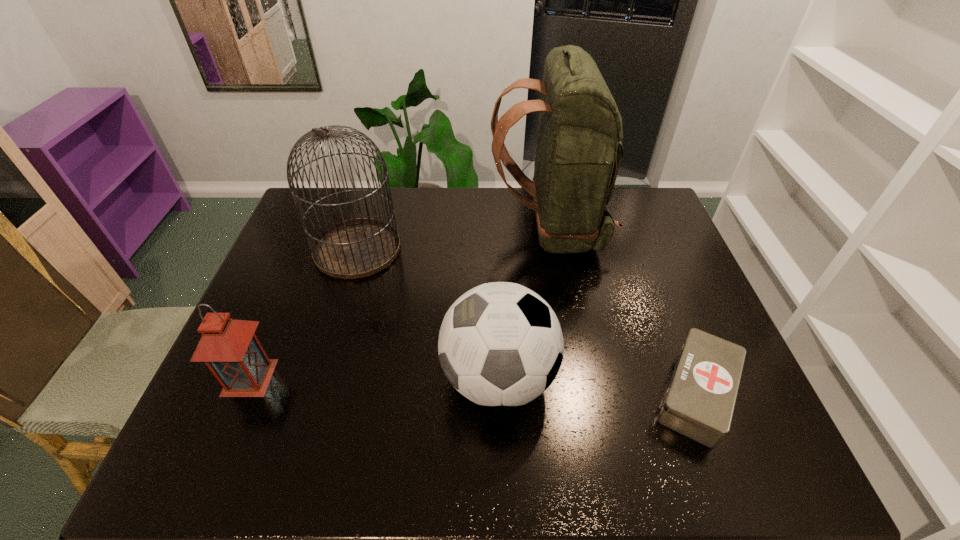
You are a GUI agent. You are given a task and a screenshot of the screen. Output one action in this format:
    pyautogui.click(x=<x>, y=<y>)
    Task: Click on the object located at the far left corner
    The width and height of the screenshot is (960, 540).
    Given the screenshot: What is the action you would take?
    pyautogui.click(x=356, y=248)

This screenshot has height=540, width=960. What are the coordinates of `object positioned at the near right corner` in the screenshot? It's located at (699, 403).

Where is `vacant point at the far edge`? vacant point at the far edge is located at coordinates (463, 219).

Locate an element on the screen. Image resolution: width=960 pixels, height=540 pixels. free space at the near edge is located at coordinates (385, 460).

Find the location of `vacant space at the right edge`. vacant space at the right edge is located at coordinates [632, 251].

In order to click on free space at the far right corner of the desktop in this screenshot , I will do `click(643, 227)`.

The image size is (960, 540). Find the location of `free space between the first-aid kit and the soccer ball`. free space between the first-aid kit and the soccer ball is located at coordinates (597, 386).

You are a GUI agent. You are given a task and a screenshot of the screen. Output one action in this format:
    pyautogui.click(x=<x>, y=<y>)
    Task: Click on the unoccupied position between the shortest object and the soccer ball
    Image resolution: width=960 pixels, height=540 pixels.
    Given the screenshot: What is the action you would take?
    pyautogui.click(x=597, y=386)

The image size is (960, 540). I want to click on empty space that is in between the soccer ball and the first-aid kit, so tap(597, 386).

Find the location of a particular element. Image resolution: width=960 pixels, height=540 pixels. vacant area that lies between the backpack and the birdcage is located at coordinates (453, 239).